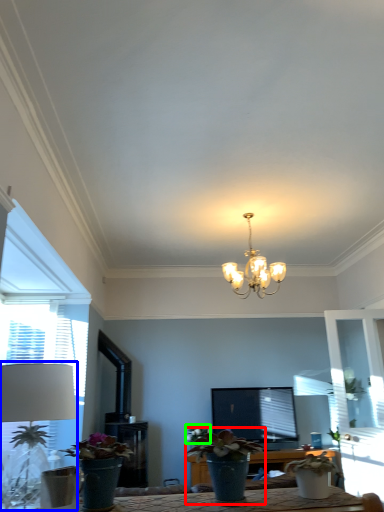
Question: Which is nearer to the houseplant (highlighted by a red box)? table lamp (highlighted by a blue box) or flower (highlighted by a green box).

Choices:
 (A) table lamp
 (B) flower

Answer: (B)